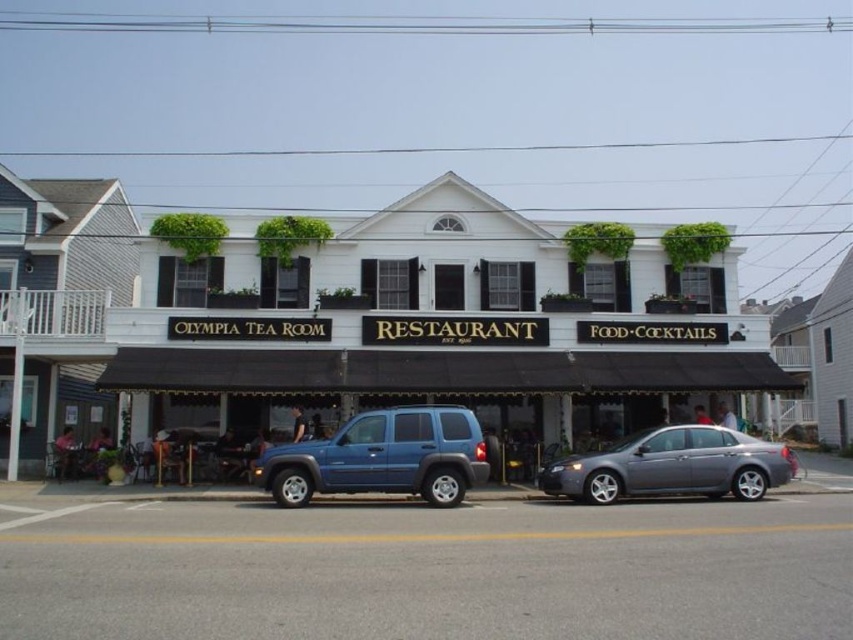
Question: Among these objects, which one is nearest to the camera?

Choices:
 (A) metallic gray sedan at center
 (B) blue matte suv at center

Answer: (B)

Question: Is blue matte suv at center thinner than metallic gray sedan at center?

Choices:
 (A) yes
 (B) no

Answer: (A)

Question: Where is blue matte suv at center located in relation to metallic gray sedan at center in the image?

Choices:
 (A) left
 (B) right

Answer: (A)

Question: Which object appears farthest from the camera in this image?

Choices:
 (A) blue matte suv at center
 (B) metallic gray sedan at center

Answer: (B)

Question: Can you confirm if blue matte suv at center is smaller than metallic gray sedan at center?

Choices:
 (A) no
 (B) yes

Answer: (B)